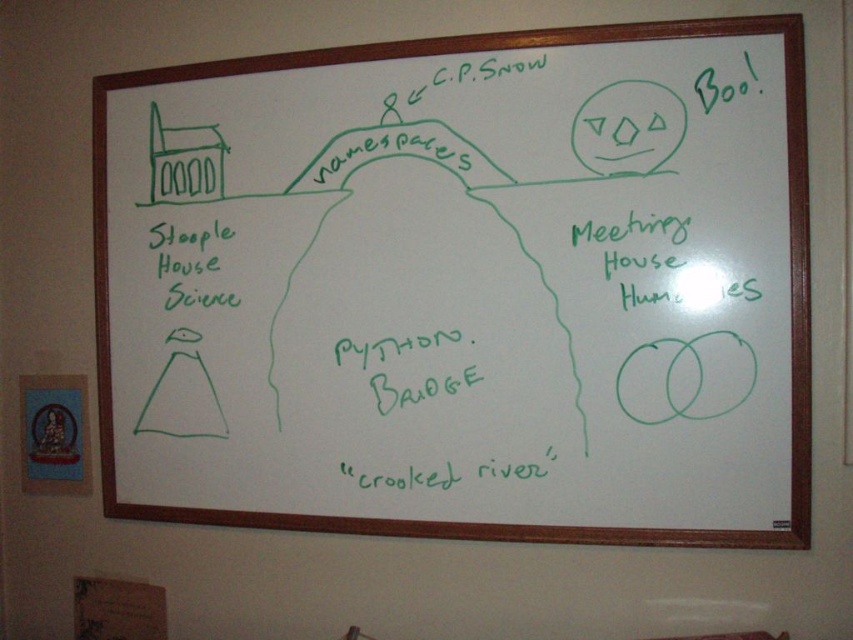
Is point (753, 509) in front of point (218, 269)?

Yes, it is.

The width and height of the screenshot is (853, 640). Find the location of `whiteboard at upper center`. whiteboard at upper center is located at coordinates (467, 288).

Image resolution: width=853 pixels, height=640 pixels. Find the location of `whiteboard at upper center`. whiteboard at upper center is located at coordinates (467, 288).

The width and height of the screenshot is (853, 640). In order to click on whiteboard at upper center in this screenshot , I will do `click(467, 288)`.